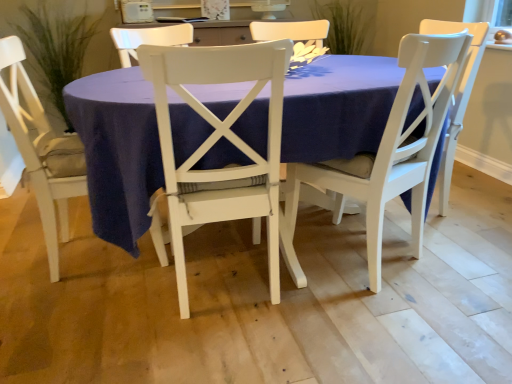
Question: Is green leafy plant at upper center, which is the 1th plant in right-to-left order, taller than white wood chair at center, acting as the 2th chair starting from the left?

Choices:
 (A) no
 (B) yes

Answer: (A)

Question: Does green leafy plant at upper center, which is the second plant in left-to-right order, have a smaller size compared to white wood chair at center, the 2th chair positioned from the right?

Choices:
 (A) yes
 (B) no

Answer: (A)

Question: Is the depth of green leafy plant at upper center, which is the second plant in left-to-right order, greater than that of white wood chair at center, the 2th chair positioned from the right?

Choices:
 (A) no
 (B) yes

Answer: (B)

Question: Is green leafy plant at upper center, which is the second plant in left-to-right order, not close to white wood chair at center, the 2th chair positioned from the right?

Choices:
 (A) no
 (B) yes

Answer: (B)

Question: Considering the relative sizes of green leafy plant at upper center, which is the second plant in left-to-right order, and white wood chair at center, the 2th chair positioned from the right, in the image provided, is green leafy plant at upper center, which is the second plant in left-to-right order, bigger than white wood chair at center, the 2th chair positioned from the right,?

Choices:
 (A) yes
 (B) no

Answer: (B)

Question: Can you confirm if green leafy plant at upper center, which is the second plant in left-to-right order, is wider than white wood chair at center, acting as the 2th chair starting from the left?

Choices:
 (A) yes
 (B) no

Answer: (A)

Question: Is green leafy plant at upper center, which is the 1th plant in right-to-left order, closer to the viewer compared to matte white table at center?

Choices:
 (A) no
 (B) yes

Answer: (A)

Question: Is green leafy plant at upper center, which is the 1th plant in right-to-left order, thinner than matte white table at center?

Choices:
 (A) yes
 (B) no

Answer: (A)

Question: Is green leafy plant at upper center, which is the 1th plant in right-to-left order, not inside matte white table at center?

Choices:
 (A) no
 (B) yes

Answer: (B)

Question: Can you confirm if green leafy plant at upper center, which is the second plant in left-to-right order, is taller than matte white table at center?

Choices:
 (A) yes
 (B) no

Answer: (B)

Question: From the image's perspective, is green leafy plant at upper center, which is the second plant in left-to-right order, located beneath matte white table at center?

Choices:
 (A) no
 (B) yes

Answer: (A)

Question: Is green leafy plant at upper center, which is the 1th plant in right-to-left order, oriented towards matte white table at center?

Choices:
 (A) yes
 (B) no

Answer: (B)

Question: Does green leafy plant at upper center, which is the second plant in left-to-right order, lie in front of white wood chair at center, the 3th chair viewed from the left?

Choices:
 (A) no
 (B) yes

Answer: (A)